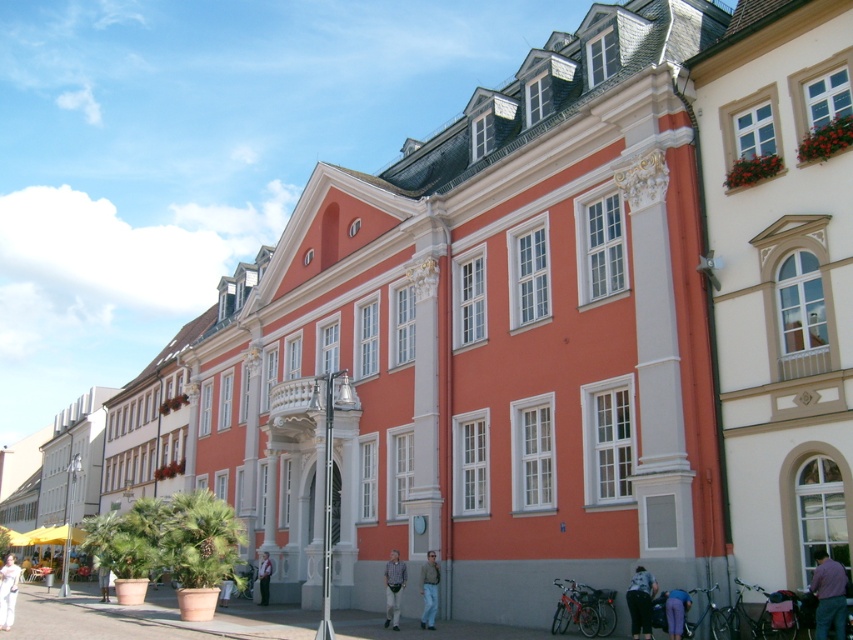
Question: Among these points, which one is nearest to the camera?

Choices:
 (A) (636, 616)
 (B) (6, 576)
 (C) (820, 573)
 (D) (436, 593)

Answer: (C)

Question: Which of the following is the farthest from the observer?

Choices:
 (A) white cotton dress at lower left
 (B) purple shirt at lower right
 (C) purple fabric pants at lower right

Answer: (A)

Question: Can you confirm if striped cotton shirt at lower center is positioned above light brown leather jacket at lower center?

Choices:
 (A) yes
 (B) no

Answer: (A)

Question: Which is nearer to the denim jeans at lower center?

Choices:
 (A) striped cotton shirt at lower center
 (B) purple shirt at lower right
 (C) purple fabric pants at lower right
 (D) light brown leather jacket at lower center

Answer: (A)

Question: Is purple fabric pants at lower right to the right of light brown leather jacket at lower center from the viewer's perspective?

Choices:
 (A) yes
 (B) no

Answer: (A)

Question: Can you confirm if purple shirt at lower right is positioned below denim jeans at lower center?

Choices:
 (A) no
 (B) yes

Answer: (A)